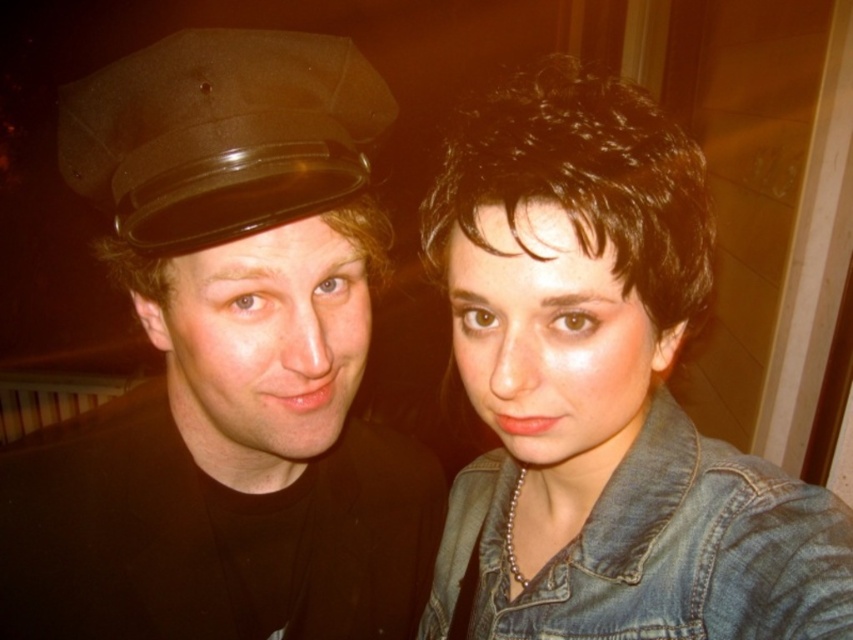
You are a photographer trying to focus on the denim jacket at upper right. Will the faded denim jacket at lower right be visible behind it?

The denim jacket at upper right is in front of the faded denim jacket at lower right, so the faded denim jacket at lower right will be visible behind it.

You are a photographer trying to frame a shot of the two people in the image. The minimum distance required between the denim jacket at upper right and the shiny brown hat at upper left for your camera to focus properly is 20 centimeters. Based on the scene, will the camera be able to focus?

The denim jacket at upper right is 20.33 centimeters from the shiny brown hat at upper left, which is just over the minimum required distance of 20 centimeters. Therefore, the camera should be able to focus properly.